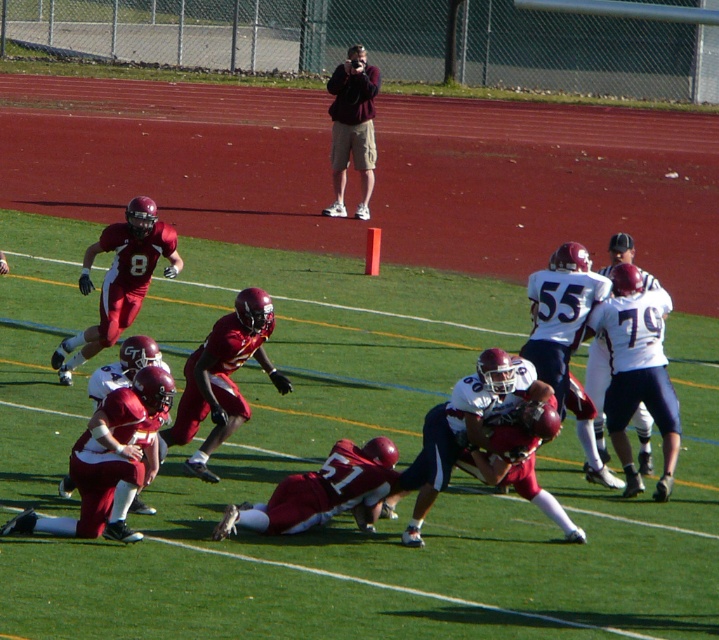
Image resolution: width=719 pixels, height=640 pixels. What do you see at coordinates (119, 280) in the screenshot?
I see `shiny red football player at left` at bounding box center [119, 280].

From the picture: How much distance is there between shiny red football player at left and maroon fabric jacket at upper center?

The distance of shiny red football player at left from maroon fabric jacket at upper center is 9.05 meters.

This screenshot has height=640, width=719. What do you see at coordinates (119, 280) in the screenshot? I see `shiny red football player at left` at bounding box center [119, 280].

Locate an element on the screen. shiny red football player at left is located at coordinates (119, 280).

Does shiny red football players at center appear under maroon fabric jacket at upper center?

Correct, shiny red football players at center is located below maroon fabric jacket at upper center.

Does shiny red football players at center have a lesser height compared to maroon fabric jacket at upper center?

Indeed, shiny red football players at center has a lesser height compared to maroon fabric jacket at upper center.

The height and width of the screenshot is (640, 719). What are the coordinates of `shiny red football players at center` in the screenshot? It's located at (316, 364).

The image size is (719, 640). In order to click on shiny red football players at center in this screenshot , I will do `click(316, 364)`.

Does maroon fabric football player at center come in front of maroon fabric jacket at upper center?

Yes, it is.

Describe the element at coordinates (109, 460) in the screenshot. The width and height of the screenshot is (719, 640). I see `maroon fabric football player at center` at that location.

Find the location of a particular element. This screenshot has width=719, height=640. maroon fabric football player at center is located at coordinates (109, 460).